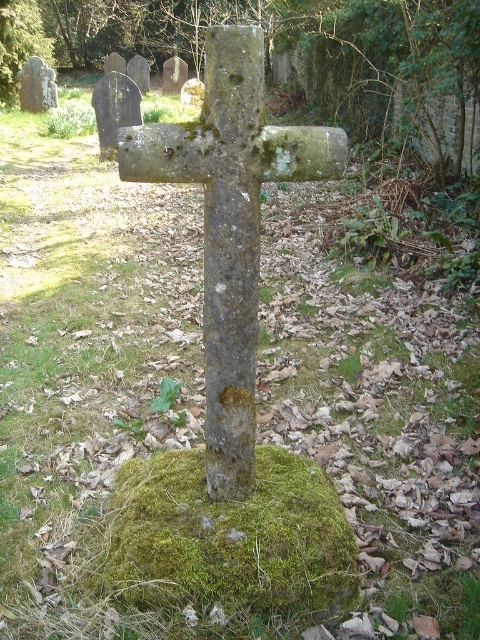
You are standing in a cemetery and see the point marked at coordinates (284, 51). Based on the scene description, where is this point located?

The point marked at coordinates (284, 51) is located on the green mossy cross at center.

Based on the photo, you are standing in front of the weathered stone cross in the cemetery. You notice two points marked on the cross. One is at point coordinates point (67,22) and the other is at point coordinates point (342,156). Which point is closer to you?

Point (67,22) is further to the camera than point (342,156), so the point closer to you is point (342,156).